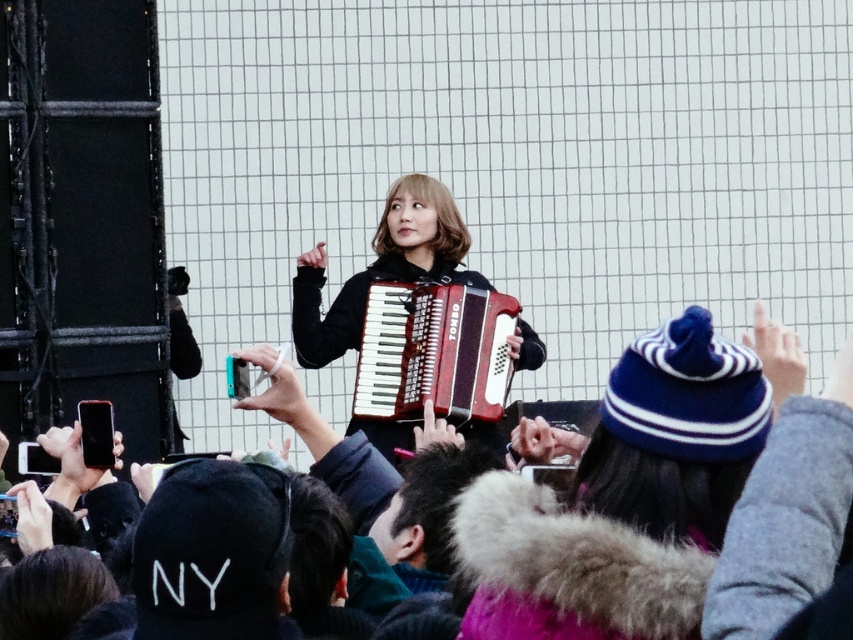
Question: Which object is positioned farthest from the matte red wood accordion at center?

Choices:
 (A) matte black accordion at center
 (B) velvet blue beanie at center

Answer: (B)

Question: Does matte red wood accordion at center have a larger size compared to matte black accordion at center?

Choices:
 (A) no
 (B) yes

Answer: (A)

Question: Does matte red wood accordion at center appear over matte black accordion at center?

Choices:
 (A) no
 (B) yes

Answer: (A)

Question: Which object appears closest to the camera in this image?

Choices:
 (A) matte red wood accordion at center
 (B) velvet blue beanie at center
 (C) matte black accordion at center

Answer: (B)

Question: Based on their relative distances, which object is farther from the matte red wood accordion at center?

Choices:
 (A) matte black accordion at center
 (B) velvet blue beanie at center

Answer: (B)

Question: Does matte red wood accordion at center appear on the right side of matte black accordion at center?

Choices:
 (A) yes
 (B) no

Answer: (A)